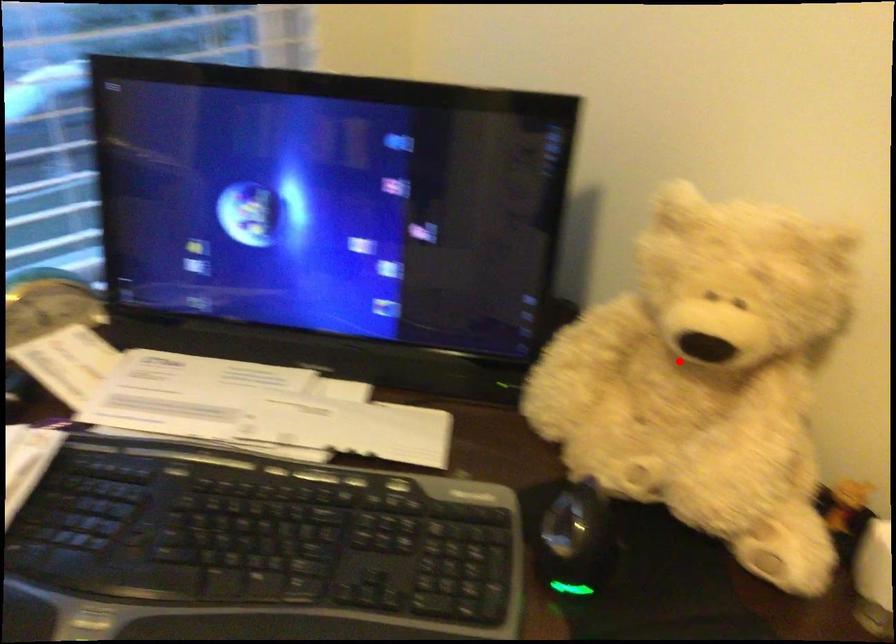
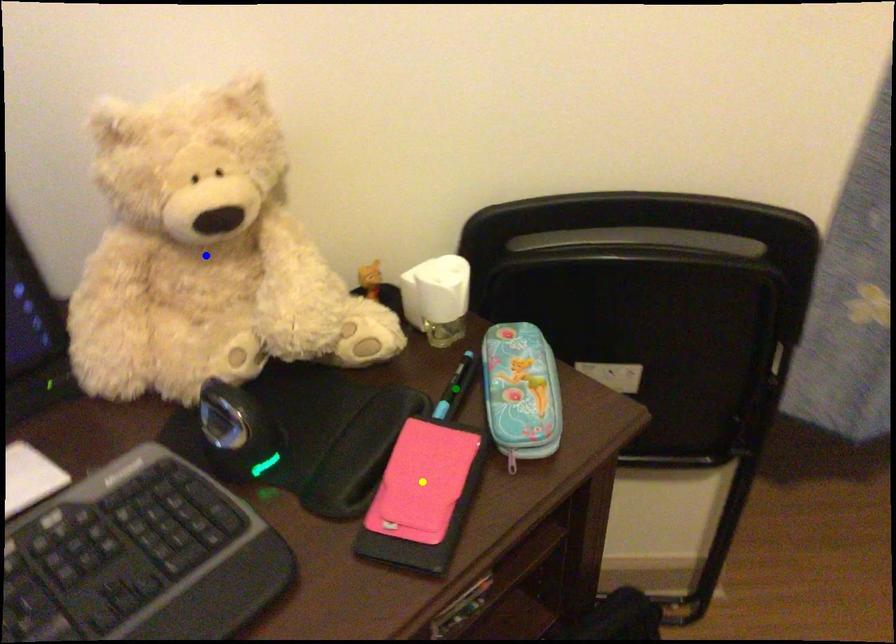
Question: I am providing you with two images of the same scene from different viewpoints. A red point is marked on the first image. You are given multiple points on the second image. Can you choose the point in image 2 that corresponds to the point in image 1?

Choices:
 (A) green point
 (B) blue point
 (C) yellow point

Answer: (B)